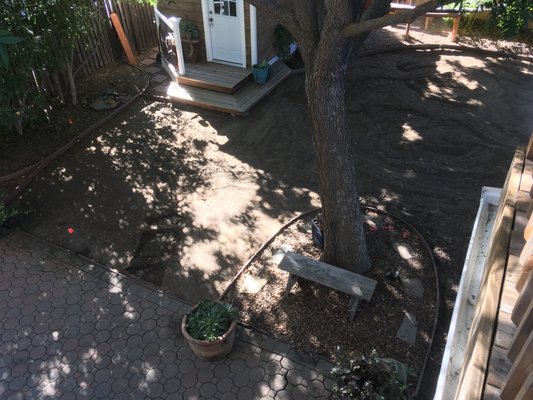
Identify the location of bench. (320, 271).